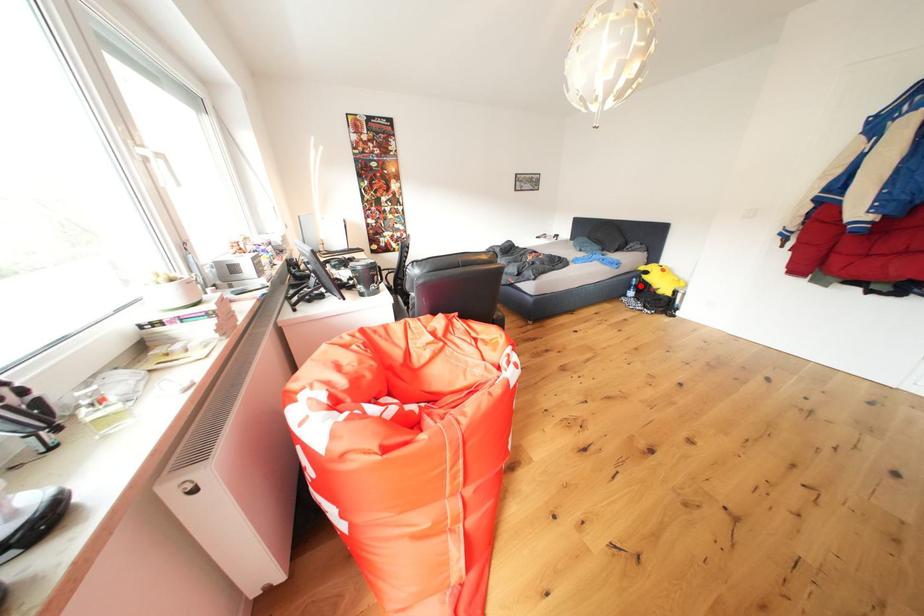
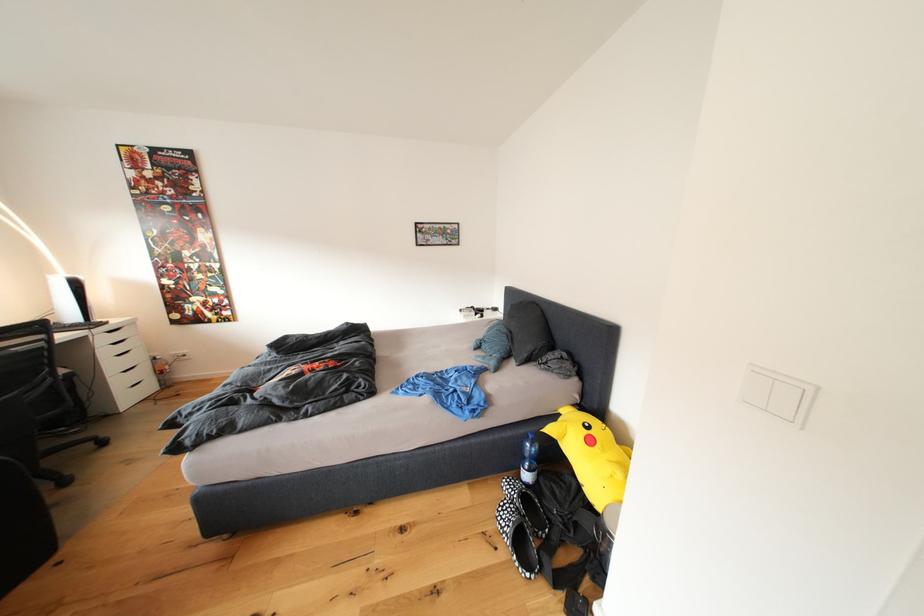
Find the pixel in the second image that matches the highlighted location in the first image.

(531, 451)